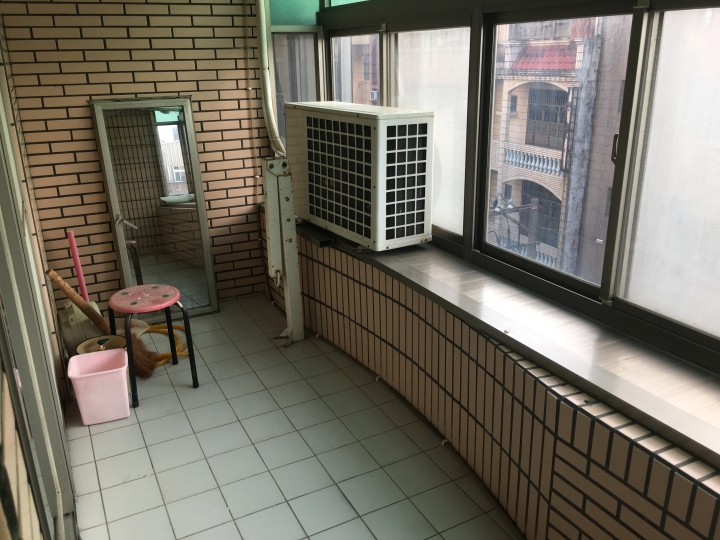
The image size is (720, 540). Identify the location of tile floor. (180, 486).